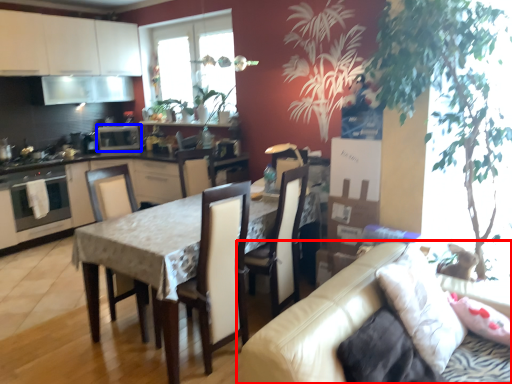
Question: Which point is further to the camera, studio couch (highlighted by a red box) or appliance (highlighted by a blue box)?

Choices:
 (A) studio couch
 (B) appliance

Answer: (B)